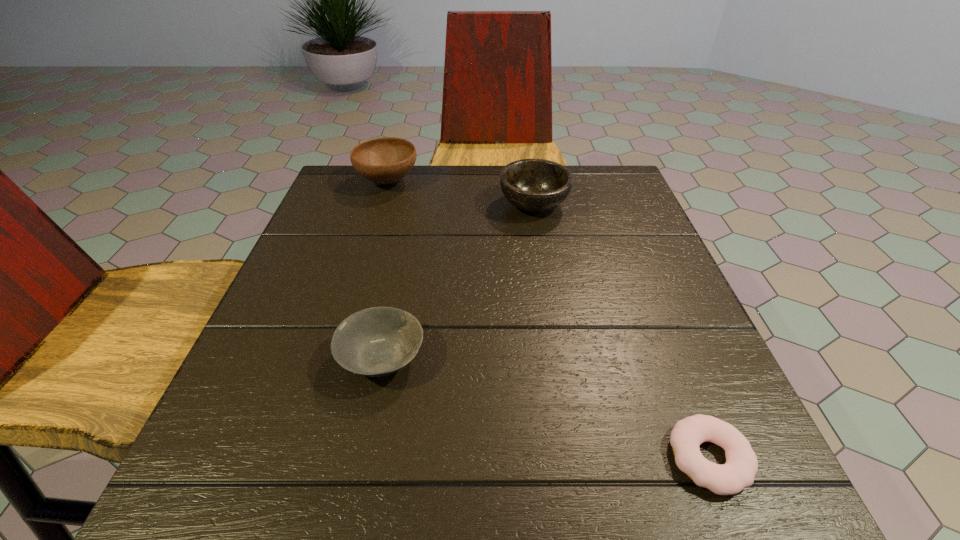
Image resolution: width=960 pixels, height=540 pixels. I want to click on the second object from right to left, so click(x=535, y=185).

At what (x,y) coordinates should I click in order to perform the action: click on the third tallest object. Please return your answer as a coordinate pair (x, y). This screenshot has width=960, height=540. Looking at the image, I should click on (374, 342).

Locate an element on the screen. the third farthest object is located at coordinates (374, 342).

Where is `the shortest object`? This screenshot has height=540, width=960. the shortest object is located at coordinates (741, 466).

The height and width of the screenshot is (540, 960). I want to click on doughnut, so click(x=741, y=466).

Identify the location of vacant space located on the left of the rightmost bowl. The width and height of the screenshot is (960, 540). (478, 205).

This screenshot has height=540, width=960. What are the coordinates of `vacant space located on the left of the third farthest object` in the screenshot? It's located at (278, 358).

Where is `vacant area situated on the left of the nearest object`? This screenshot has height=540, width=960. vacant area situated on the left of the nearest object is located at coordinates (422, 457).

I want to click on object at the near edge, so click(741, 466).

Locate an element on the screen. object that is at the right edge is located at coordinates (741, 466).